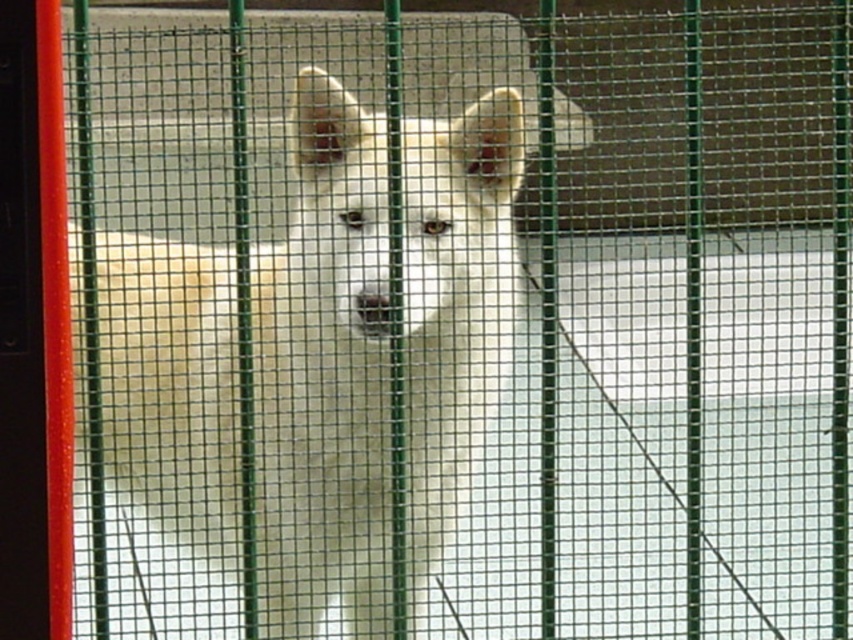
You are a delivery person who needs to approach the red plastic screen door at left to deliver a package. The white fur dog at center is blocking your path. Can you walk around the dog to reach the door without getting too close?

The distance between the white fur dog at center and the red plastic screen door at left is 3.47 feet. Since the dog is blocking your path, you can walk around it as long as there is enough space. However, the exact distance isn not specified, so it depends on the available space around the dog. If the path is wide enough, you can safely go around without getting too close.

Consider the image. You are a delivery person trying to enter a property. You see the white fur dog at center behind a green metal mesh fence and the red plastic screen door at left. Which object is larger in size?

The white fur dog at center is bigger than the red plastic screen door at left, so the white fur dog at center is larger in size.

You are a delivery person trying to see the white fur dog at center through the red plastic screen door at left. Can you see the top of the dog?

The white fur dog at center is taller than the red plastic screen door at left, so yes, you can see the top of the white fur dog at center above the red plastic screen door at left.